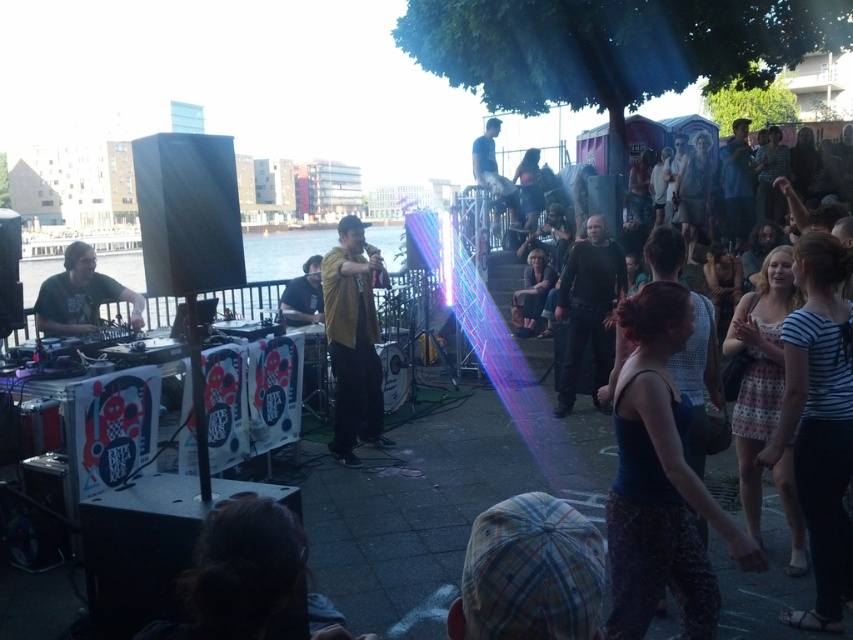
Question: Which of the following is the farthest from the observer?

Choices:
 (A) (376, 422)
 (B) (608, 250)

Answer: (B)

Question: Can you confirm if yellow matte jacket at center is bigger than matte black dj deck at left?

Choices:
 (A) no
 (B) yes

Answer: (A)

Question: Does yellow matte jacket at center appear on the right side of matte yellow shirt at center?

Choices:
 (A) no
 (B) yes

Answer: (B)

Question: Which of these objects is positioned closest to the matte yellow shirt at center?

Choices:
 (A) dark blue shirt at upper center
 (B) matte black dj deck at left
 (C) light brown leather jacket at center
 (D) yellow matte jacket at center

Answer: (D)

Question: Which point appears farthest from the camera in this image?

Choices:
 (A) (355, 465)
 (B) (59, 284)

Answer: (A)

Question: Is dark matte leather jacket at center above matte black dj deck at left?

Choices:
 (A) no
 (B) yes

Answer: (A)